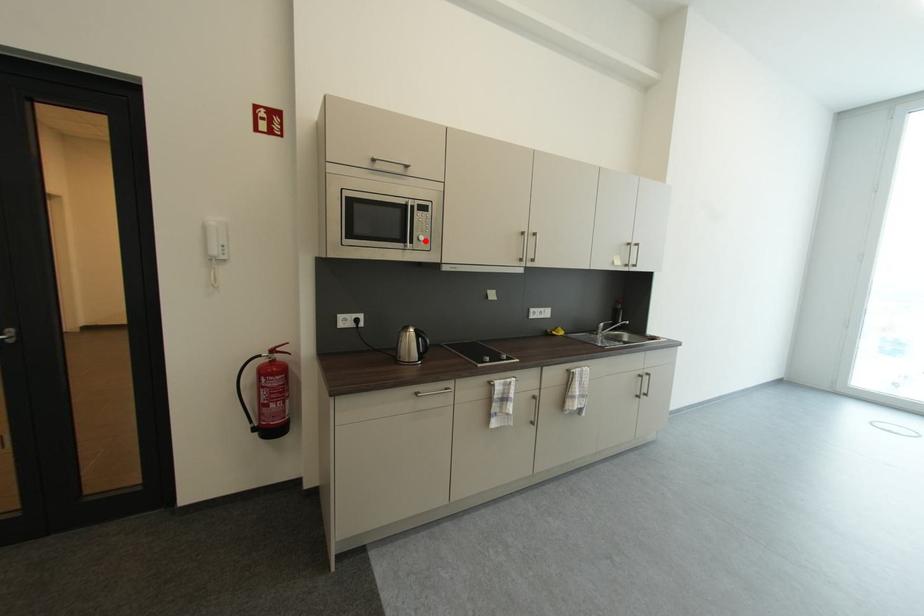
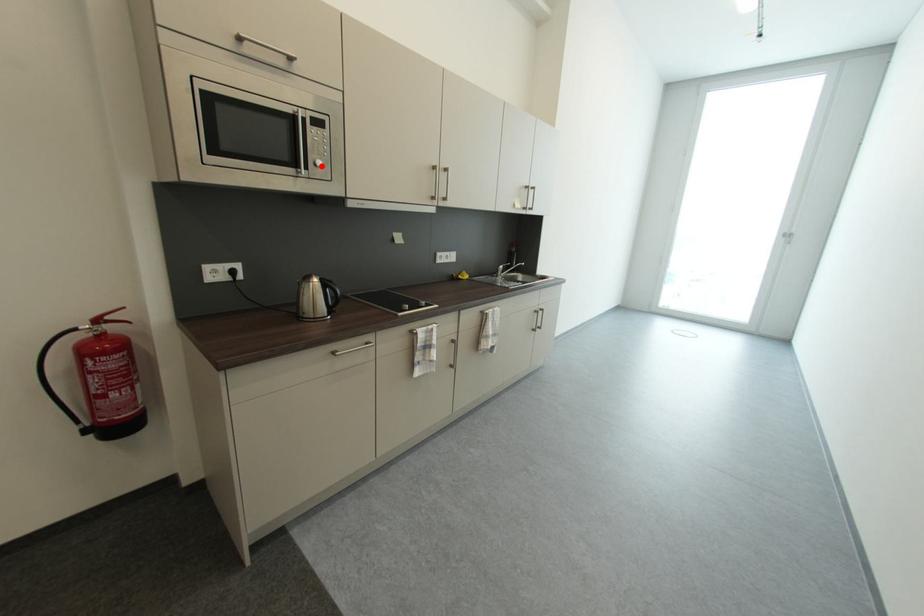
I am providing you with two images of the same scene from different viewpoints. A red point is marked on the first image and another point is marked on the second image. Does the point marked in image1 correspond to the same location as the one in image2?

Yes